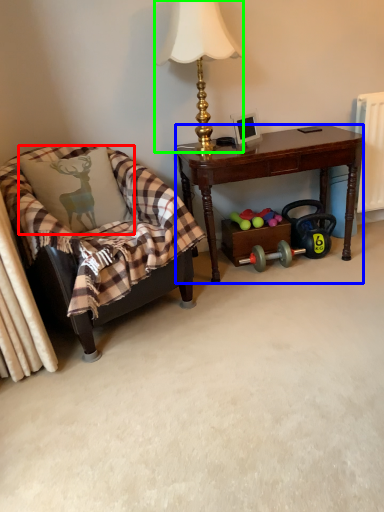
Question: Which object is positioned closest to pillow (highlighted by a red box)? Select from desk (highlighted by a blue box) and lamp (highlighted by a green box).

Choices:
 (A) desk
 (B) lamp

Answer: (A)